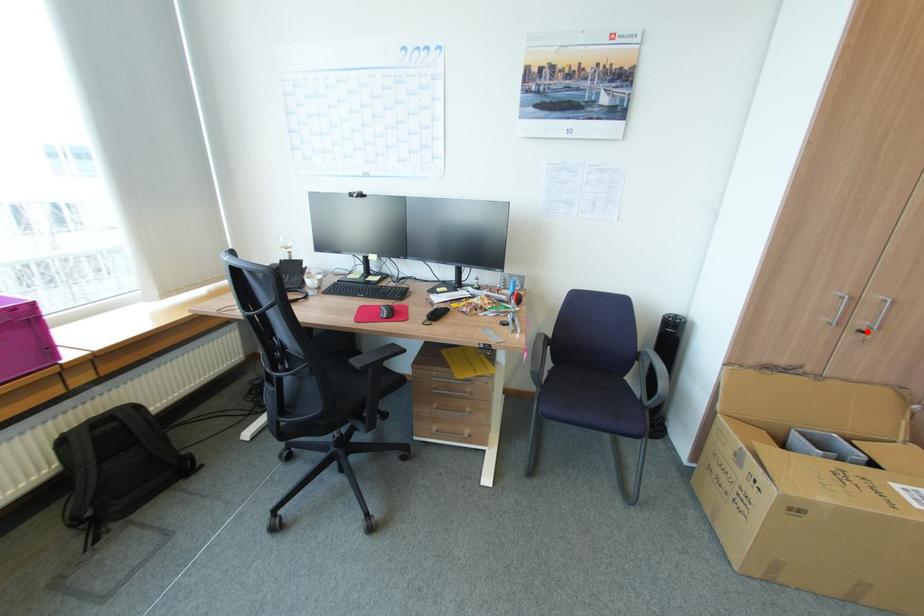
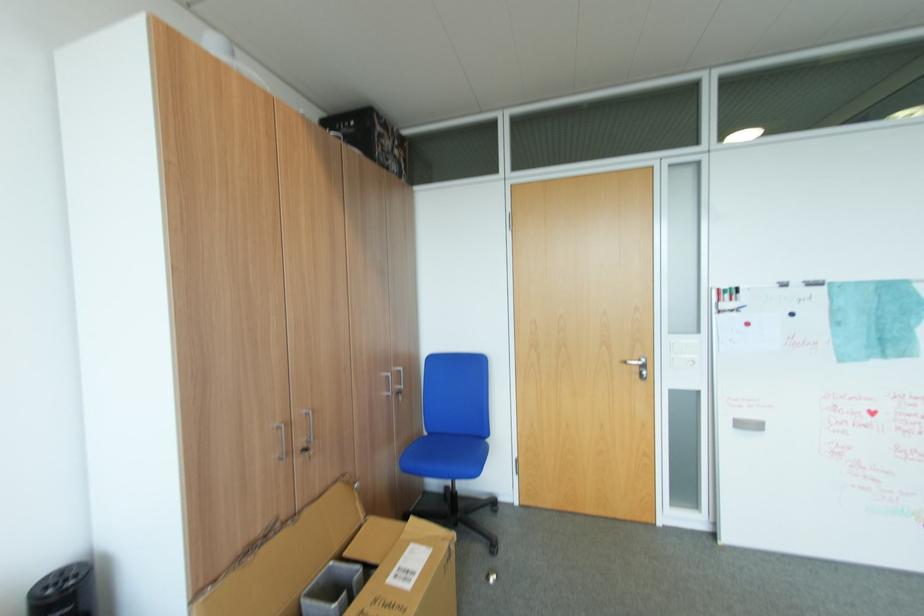
Locate, in the second image, the point that corresponds to the highlighted location in the first image.

(310, 451)